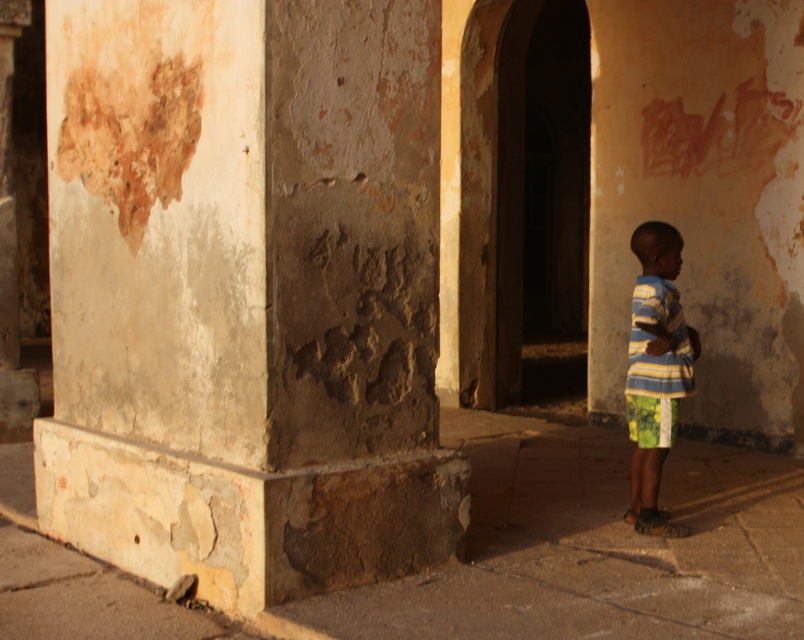
From the picture: Who is positioned more to the right, striped fabric shirt at right or green fabric shorts at lower right?

striped fabric shirt at right

Can you confirm if striped fabric shirt at right is smaller than green fabric shorts at lower right?

Actually, striped fabric shirt at right might be larger than green fabric shorts at lower right.

Is point (663, 348) behind point (647, 436)?

No, (663, 348) is in front of (647, 436).

You are a GUI agent. You are given a task and a screenshot of the screen. Output one action in this format:
    pyautogui.click(x=<x>, y=<y>)
    Task: Click on the striped fabric shirt at right
    
    Given the screenshot: What is the action you would take?
    pyautogui.click(x=655, y=371)

Who is positioned more to the left, rusty concrete pillar at center or green fabric shorts at lower right?

From the viewer's perspective, rusty concrete pillar at center appears more on the left side.

Which is below, rusty concrete pillar at center or green fabric shorts at lower right?

green fabric shorts at lower right

Where is `rusty concrete pillar at center`? Image resolution: width=804 pixels, height=640 pixels. rusty concrete pillar at center is located at coordinates pos(245,294).

Is rusty concrete pillar at center below striped fabric shirt at right?

Actually, rusty concrete pillar at center is above striped fabric shirt at right.

Between point (187, 348) and point (626, 397), which one is positioned in front?

Point (187, 348) is in front.

Find the location of a particular element. rusty concrete pillar at center is located at coordinates (245, 294).